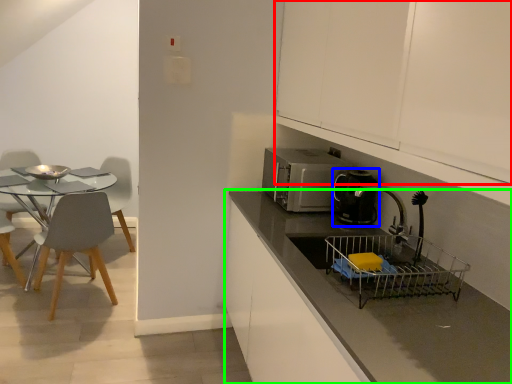
Question: Which is nearer to the cabinetry (highlighted by a red box)? kitchen appliance (highlighted by a blue box) or countertop (highlighted by a green box).

Choices:
 (A) kitchen appliance
 (B) countertop

Answer: (A)